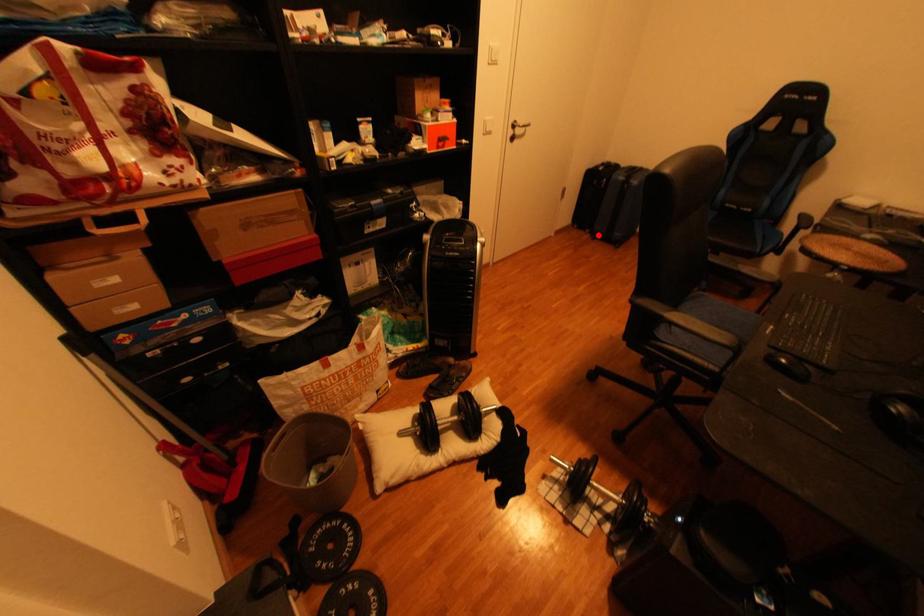
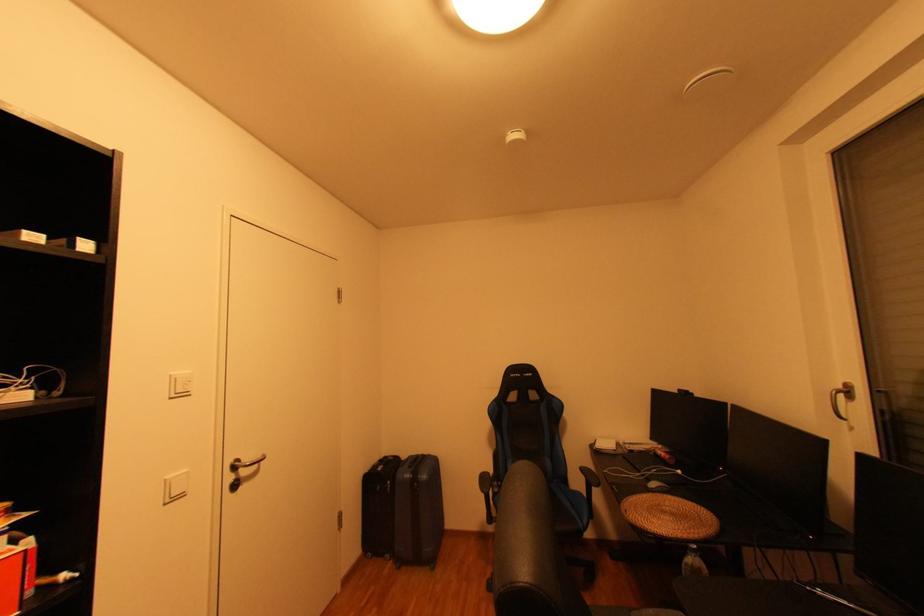
Question: I am providing you with two images of the same scene from different viewpoints. A red point is marked on the first image. Can you still see the location of the red point in image 2?

Choices:
 (A) Yes
 (B) No

Answer: (A)